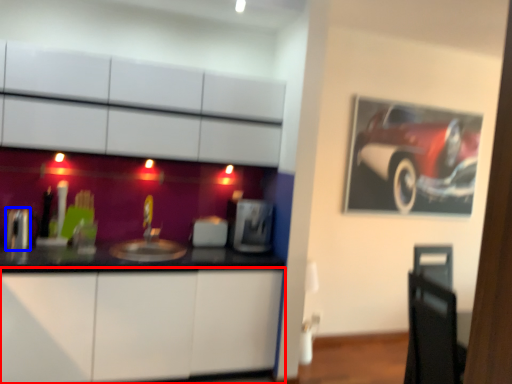
Question: Which of the following is the closest to the observer, cabinetry (highlighted by a red box) or appliance (highlighted by a blue box)?

Choices:
 (A) cabinetry
 (B) appliance

Answer: (A)